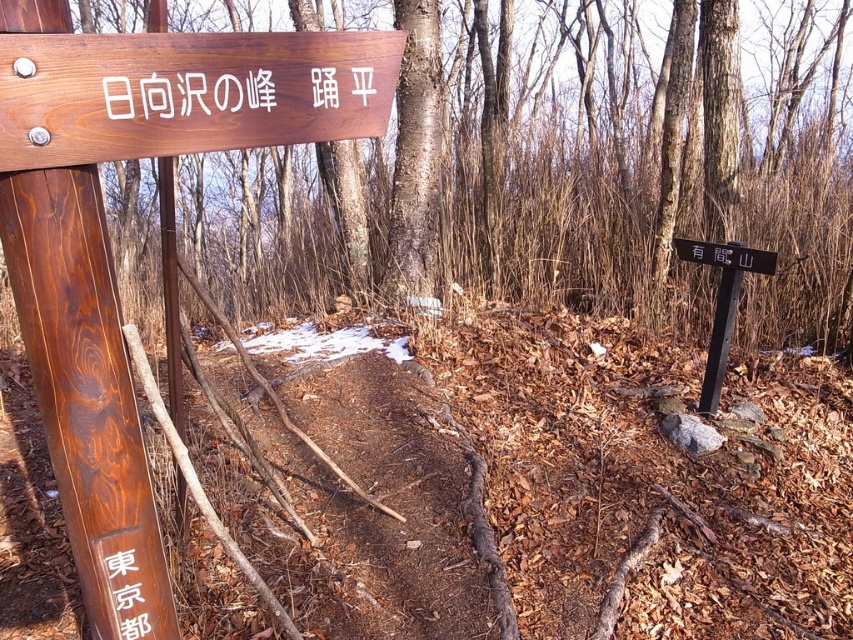
You are a hiker trying to read two signs in the forest. The wooden sign at upper left and the black metal signpost at right. Which one is larger in size?

The wooden sign at upper left is bigger than the black metal signpost at right.

You are hiking in the forest and come across two signposts. You see the wooden sign at upper left and the black wood sign at right. Which sign is closer to you?

The wooden sign at upper left is closer to you because it is in front of the black wood sign at right.

You are hiking in the forest and come across two signs. You need to follow the directions on the wooden sign at upper left and the black metal signpost at right. Which sign should you look at first to determine your next path?

You should look at the wooden sign at upper left first because it is located above the black metal signpost at right, making it more visible from a distance.